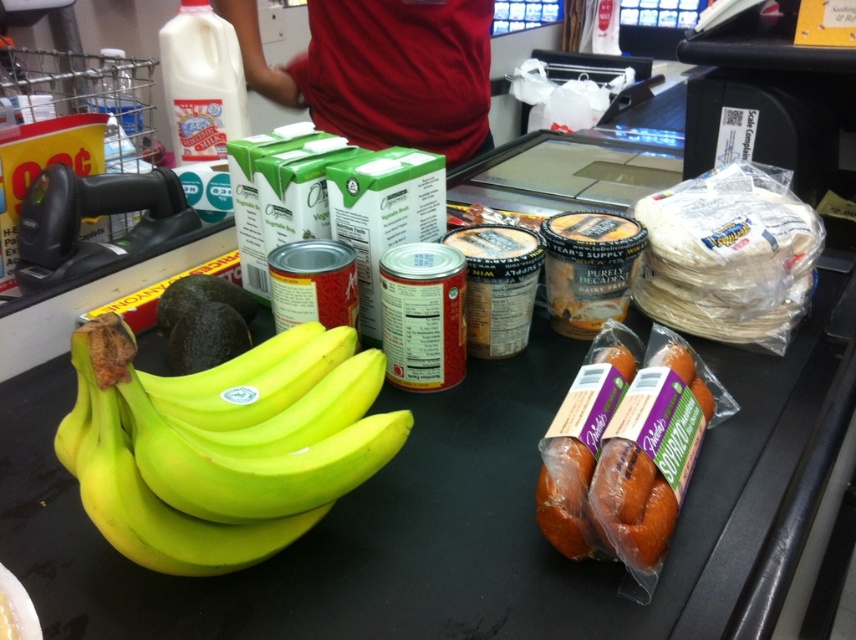
You are a customer at the checkout counter and want to grab the yellow shiny bananas at left and the white matte yoghurt at upper left. Which one should you reach for first if you want to pick up the one that is closer to you?

The yellow shiny bananas at left is closer to you because it is positioned below the white matte yoghurt at upper left, meaning it is lower and thus nearer in the scene.

Based on the photo, you are a customer at the checkout counter and want to grab the translucent plastic sausage at center right. Where should you look on the counter?

The translucent plastic sausage at center right is located at the 2D coordinates point (605, 500) on the counter.